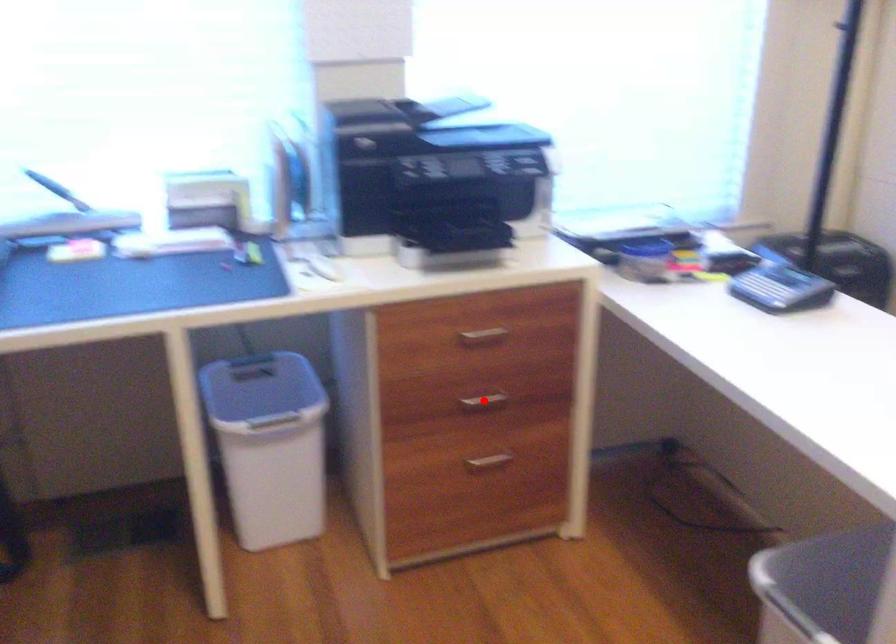
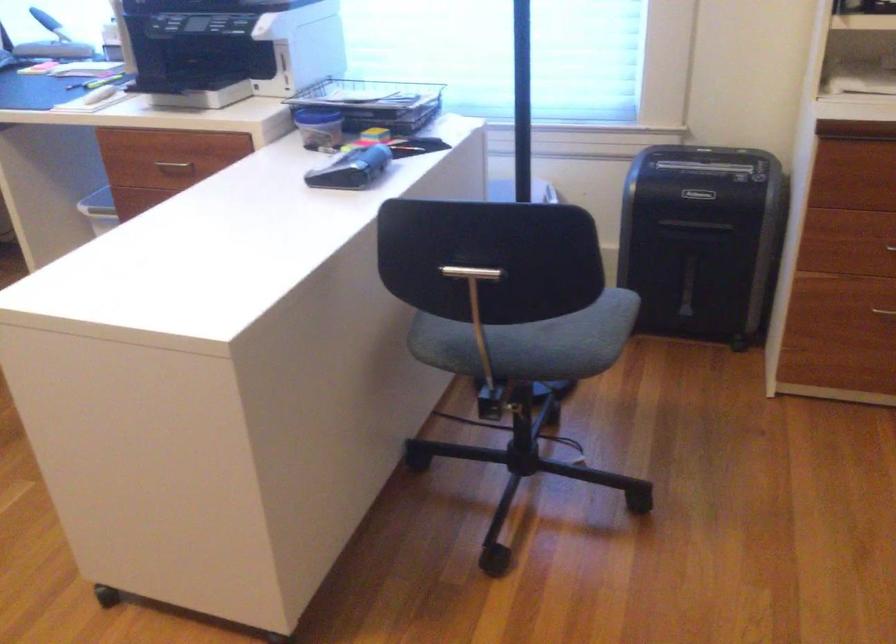
Question: I am providing you with two images of the same scene from different viewpoints. A red point is marked on the first image. Is the red point's position out of view in image 2?

Choices:
 (A) Yes
 (B) No

Answer: (A)